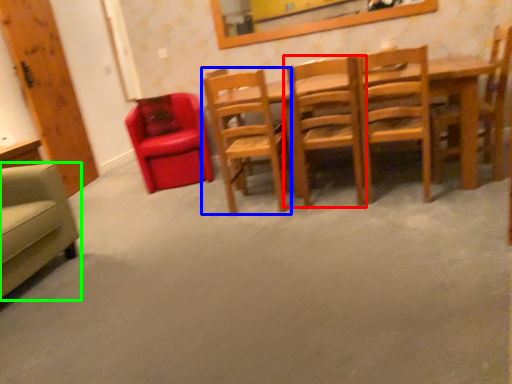
Question: Based on their relative distances, which object is nearer to chair (highlighted by a red box)? Choose from chair (highlighted by a blue box) and chair (highlighted by a green box).

Choices:
 (A) chair
 (B) chair

Answer: (A)